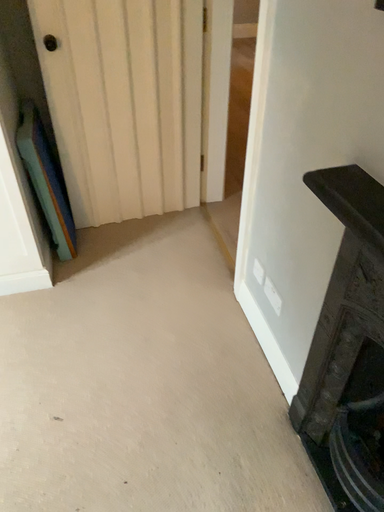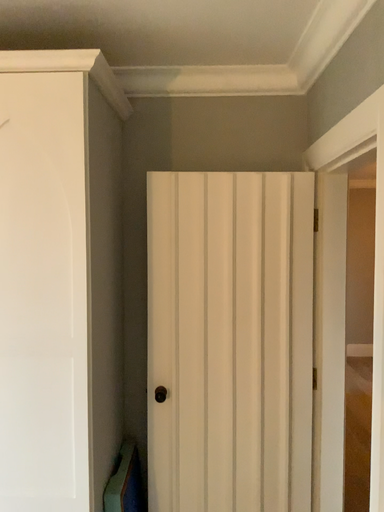
Question: How did the camera likely rotate when shooting the video?

Choices:
 (A) rotated left
 (B) rotated right

Answer: (A)